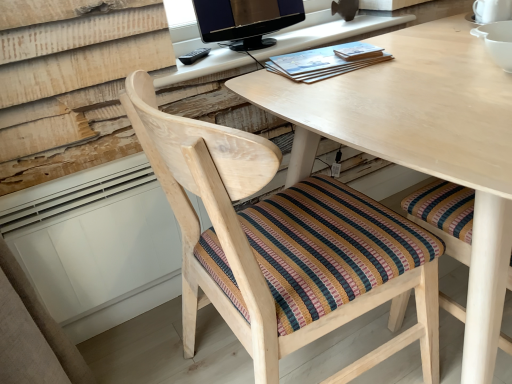
Where is `free location in front of blue paperback book at center`? free location in front of blue paperback book at center is located at coordinates (358, 89).